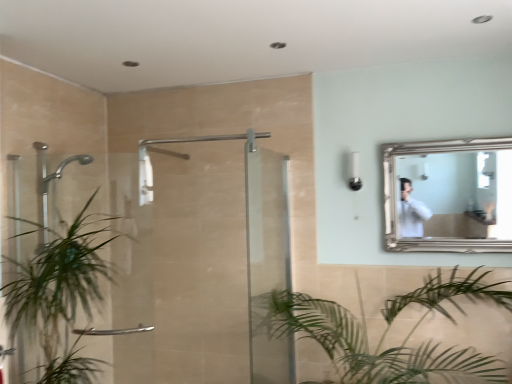
Question: In terms of height, does clear glass door at center, which is counted as the 2th screen door, starting from the left, look taller or shorter compared to clear glass shower door at left, placed as the 1th screen door when sorted from left to right?

Choices:
 (A) short
 (B) tall

Answer: (B)

Question: In terms of width, does clear glass door at center, which is counted as the 2th screen door, starting from the left, look wider or thinner when compared to clear glass shower door at left, placed as the 1th screen door when sorted from left to right?

Choices:
 (A) wide
 (B) thin

Answer: (B)

Question: Which is nearer to the clear glass shower door at left, placed as the 1th screen door when sorted from left to right?

Choices:
 (A) green leafy plant at left, placed as the second houseplant when sorted from right to left
 (B) white plastic light fixture at upper center
 (C) clear glass door at center, which is counted as the 2th screen door, starting from the left
 (D) green leafy plant at lower center, the 1th houseplant viewed from the right
 (E) silver/golden frame mirror at upper right

Answer: (C)

Question: Based on their relative distances, which object is farther from the white plastic light fixture at upper center?

Choices:
 (A) clear glass door at center, placed as the 1th screen door when sorted from right to left
 (B) silver/golden frame mirror at upper right
 (C) clear glass shower door at left, acting as the 2th screen door starting from the right
 (D) green leafy plant at left, which ranks as the 1th houseplant in left-to-right order
 (E) green leafy plant at lower center, the 1th houseplant viewed from the right

Answer: (D)